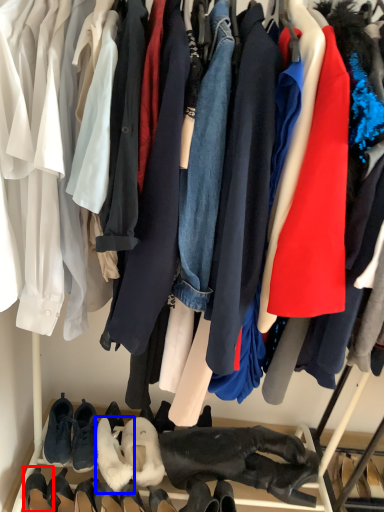
Question: Which object is further to the camera taking this photo, footwear (highlighted by a red box) or footwear (highlighted by a blue box)?

Choices:
 (A) footwear
 (B) footwear

Answer: (B)